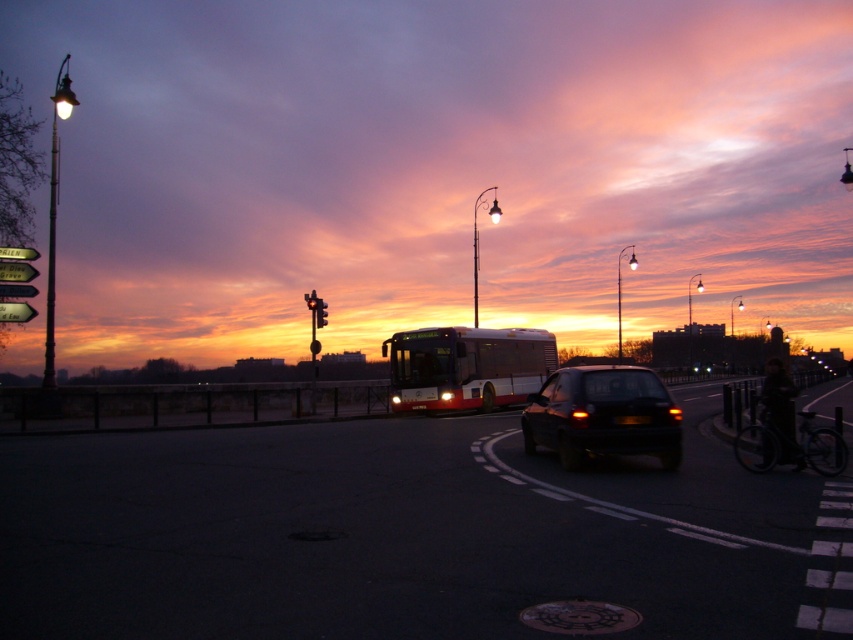
You are a driver planning to park your car in the street scene shown. The shiny black car at center is currently occupying a spot. Based on its coordinates, can you determine if there is enough space to park your car next to it without overlapping?

The coordinates of the shiny black car at center are at point (x=602, y=416). Without knowing the exact dimensions of the parking space or the size of your car, it is impossible to determine if there is enough space to park next to it without overlapping.

You are standing at the point marked by coordinates [602,416] in the image. What object is exactly at that location?

The shiny black car at center is located at point [602,416].

You are a pedestrian standing at the crosswalk near the shiny black car at center and the red glass traffic light at upper center. Which object is taller?

The shiny black car at center is taller than the red glass traffic light at upper center.